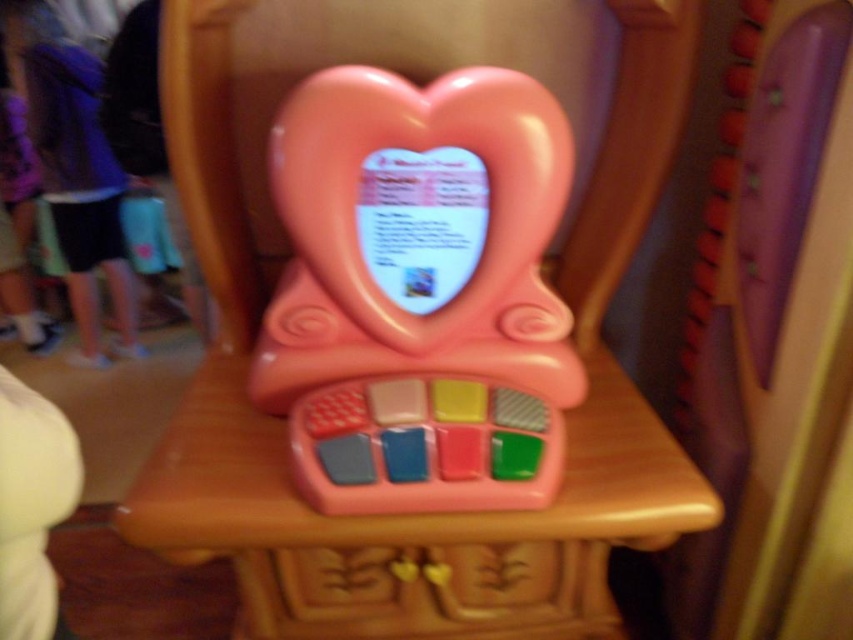
You are setting up a playroom and need to place both the pink plastic chair at center and the pink plastic toy at center. Given their sizes, which one should you place first to ensure proper arrangement?

The pink plastic chair at center is larger in size than the pink plastic toy at center, so you should place the pink plastic chair at center first to accommodate its larger size before arranging the smaller toy.